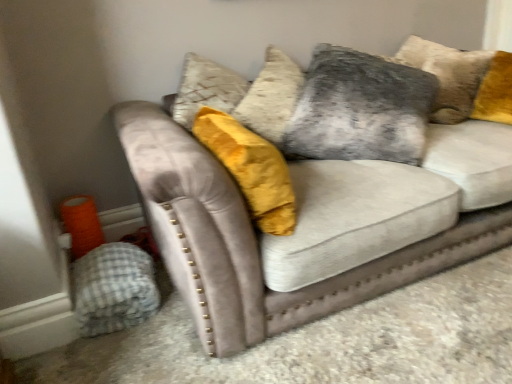
Question: Considering the relative sizes of velvet gray pillow at upper center and gray checkered blanket at lower left in the image provided, is velvet gray pillow at upper center taller than gray checkered blanket at lower left?

Choices:
 (A) no
 (B) yes

Answer: (B)

Question: Does velvet gray pillow at upper center have a smaller size compared to gray checkered blanket at lower left?

Choices:
 (A) no
 (B) yes

Answer: (A)

Question: Considering the relative sizes of velvet gray pillow at upper center and gray checkered blanket at lower left in the image provided, is velvet gray pillow at upper center shorter than gray checkered blanket at lower left?

Choices:
 (A) yes
 (B) no

Answer: (B)

Question: Is velvet gray pillow at upper center at the left side of gray checkered blanket at lower left?

Choices:
 (A) yes
 (B) no

Answer: (B)

Question: Would you consider velvet gray pillow at upper center to be distant from gray checkered blanket at lower left?

Choices:
 (A) yes
 (B) no

Answer: (B)

Question: From the image's perspective, is velvet gray pillow at upper center above gray checkered blanket at lower left?

Choices:
 (A) no
 (B) yes

Answer: (B)

Question: Is gray checkered blanket at lower left oriented towards velvet gray couch at center?

Choices:
 (A) no
 (B) yes

Answer: (B)

Question: Is gray checkered blanket at lower left smaller than velvet gray couch at center?

Choices:
 (A) no
 (B) yes

Answer: (B)

Question: Is gray checkered blanket at lower left beside velvet gray couch at center?

Choices:
 (A) yes
 (B) no

Answer: (B)

Question: Does gray checkered blanket at lower left come behind velvet gray couch at center?

Choices:
 (A) yes
 (B) no

Answer: (A)

Question: Considering the relative sizes of gray checkered blanket at lower left and velvet gray couch at center in the image provided, is gray checkered blanket at lower left wider than velvet gray couch at center?

Choices:
 (A) no
 (B) yes

Answer: (A)

Question: Can you confirm if gray checkered blanket at lower left is bigger than velvet gray couch at center?

Choices:
 (A) yes
 (B) no

Answer: (B)

Question: Is velvet gray couch at center placed right next to gray checkered blanket at lower left?

Choices:
 (A) yes
 (B) no

Answer: (B)